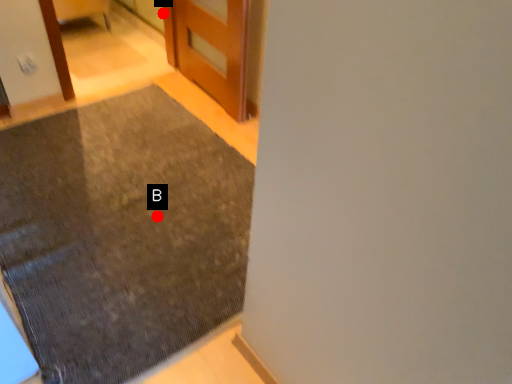
Question: Two points are circled on the image, labeled by A and B beside each circle. Which point is closer to the camera taking this photo?

Choices:
 (A) A is closer
 (B) B is closer

Answer: (B)